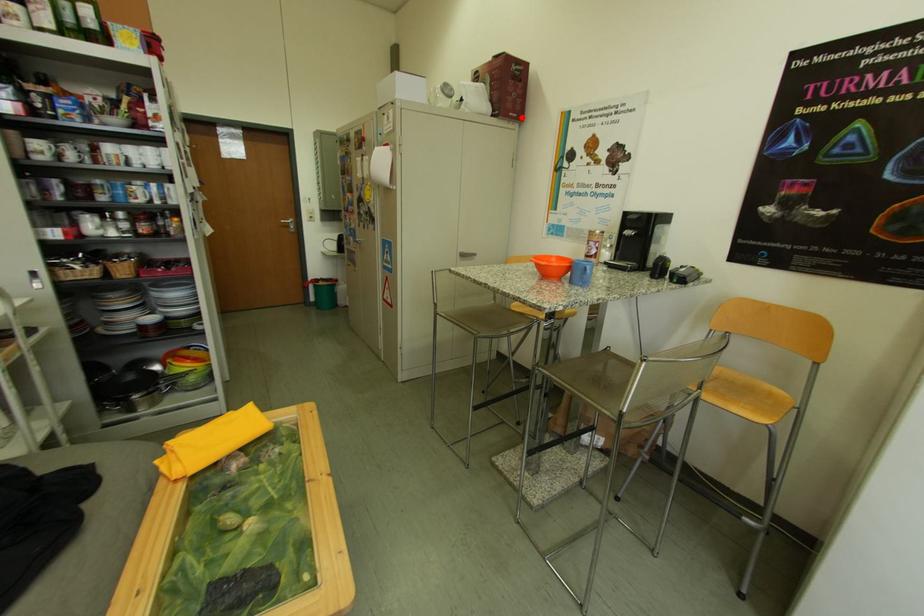
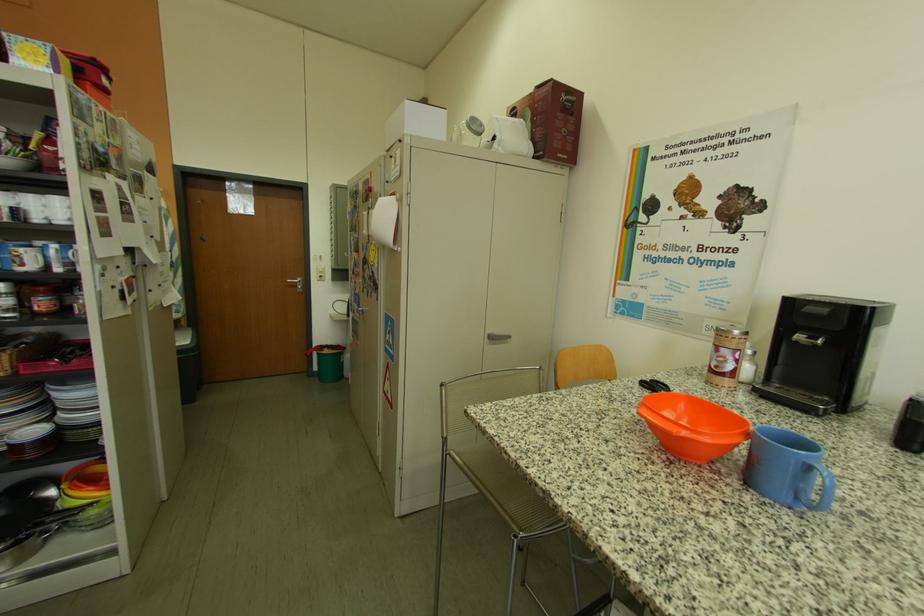
Find the pixel in the second image that matches the highlighted location in the first image.

(570, 158)